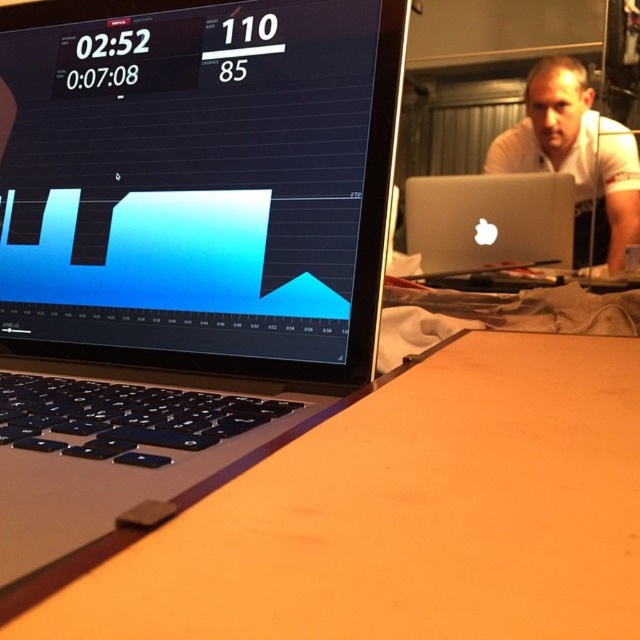
Question: Among these points, which one is farthest from the camera?

Choices:
 (A) [554, 83]
 (B) [296, 618]
 (C) [209, 84]

Answer: (A)

Question: Does wooden table at center appear under white smooth shirt at upper right?

Choices:
 (A) no
 (B) yes

Answer: (B)

Question: Which object is positioned farthest from the wooden table at center?

Choices:
 (A) white smooth shirt at upper right
 (B) silver metallic laptop at center

Answer: (A)

Question: Is the position of wooden table at center more distant than that of silver metallic laptop at center?

Choices:
 (A) yes
 (B) no

Answer: (B)

Question: Does white smooth shirt at upper right appear under silver metallic laptop at center?

Choices:
 (A) yes
 (B) no

Answer: (B)

Question: Which object appears closest to the camera in this image?

Choices:
 (A) silver metallic laptop at center
 (B) matte black laptop at center

Answer: (B)